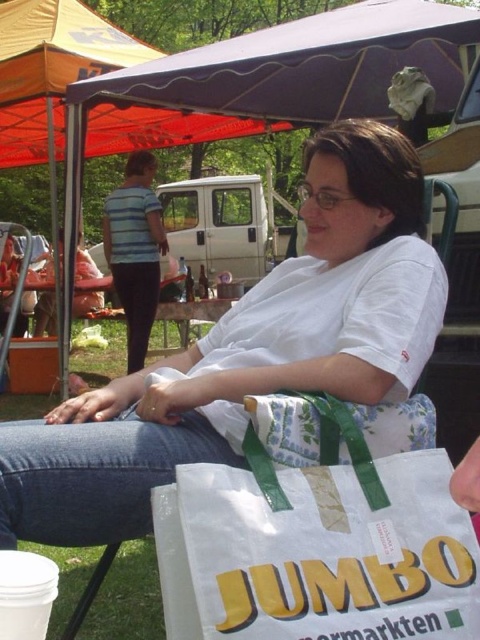
Question: Can you confirm if white cotton shirt at center is bigger than striped shirt at upper left?

Choices:
 (A) yes
 (B) no

Answer: (B)

Question: Which point is farther to the camera?

Choices:
 (A) (292, 614)
 (B) (374, 388)
 (C) (146, 340)
 (D) (119, 54)

Answer: (D)

Question: Which point is farther to the camera?

Choices:
 (A) (180, 144)
 (B) (146, 228)
 (C) (208, 577)

Answer: (A)

Question: Which object is closer to the camera taking this photo?

Choices:
 (A) striped shirt at upper left
 (B) white cotton shirt at center
 (C) white fabric bag at lower center
 (D) orange fabric canopy at upper center

Answer: (C)

Question: Can you confirm if white cotton shirt at center is positioned below white fabric bag at lower center?

Choices:
 (A) no
 (B) yes

Answer: (A)

Question: Is orange fabric canopy at upper center above striped shirt at upper left?

Choices:
 (A) no
 (B) yes

Answer: (B)